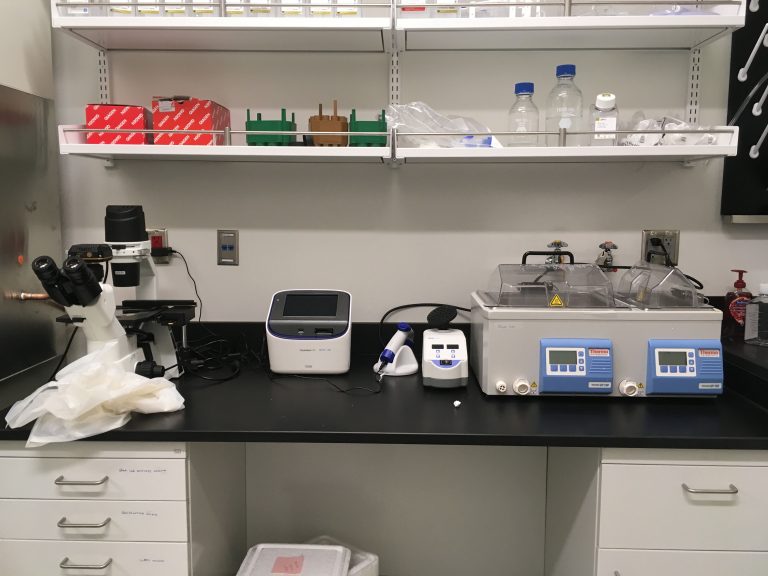
At what (x,y) coordinates should I click in order to perform the action: click on silver wall plates. Please return your answer as a coordinate pair (x, y). The height and width of the screenshot is (576, 768). Looking at the image, I should click on (154, 234), (227, 240), (672, 234).